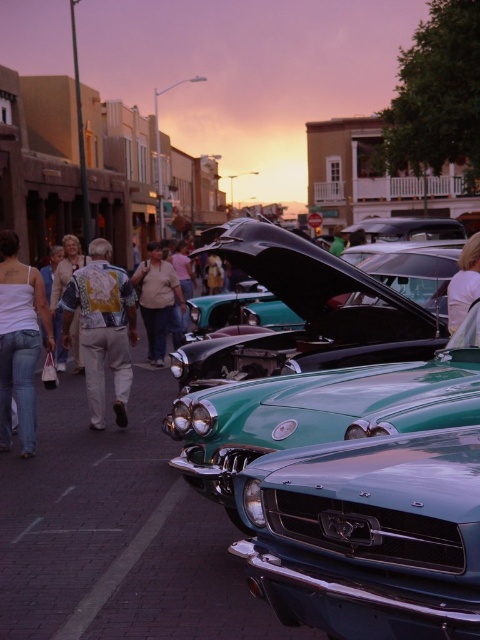
You are a photographer at the car show and want to take a photo of both the shiny teal car at center and the printed fabric shirt at center. Which object should you focus on first if you want to capture both in the same frame without moving the camera?

The shiny teal car at center is shorter than the printed fabric shirt at center, so you should focus on the shiny teal car at center first to ensure depth of field includes both objects.

You are standing at the center of the car show and notice a printed fabric shirt at center. Can you determine its exact coordinates based on the scene description?

The printed fabric shirt at center is located at point (x=103, y=328).